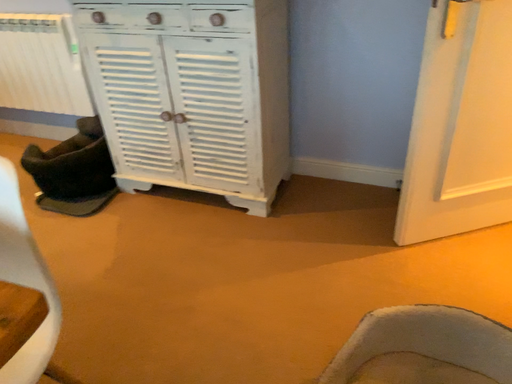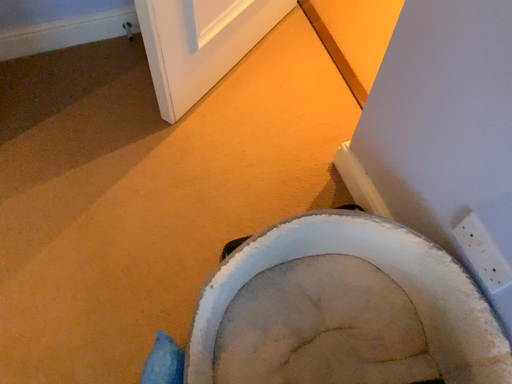
Question: Which way did the camera rotate in the video?

Choices:
 (A) rotated downward
 (B) rotated upward

Answer: (A)